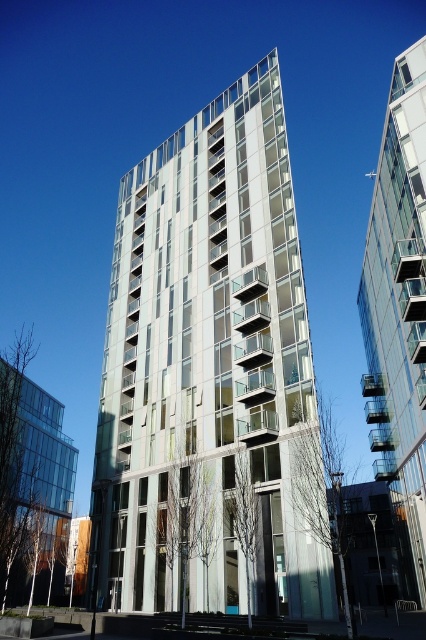
Question: Does metallic glass building at center come in front of transparent glass building at upper right?

Choices:
 (A) yes
 (B) no

Answer: (A)

Question: Is metallic glass building at center in front of transparent glass building at upper right?

Choices:
 (A) no
 (B) yes

Answer: (B)

Question: Is metallic glass building at center in front of transparent glass building at upper right?

Choices:
 (A) no
 (B) yes

Answer: (B)

Question: Which of the following is the closest to the observer?

Choices:
 (A) (287, 387)
 (B) (411, 525)

Answer: (A)